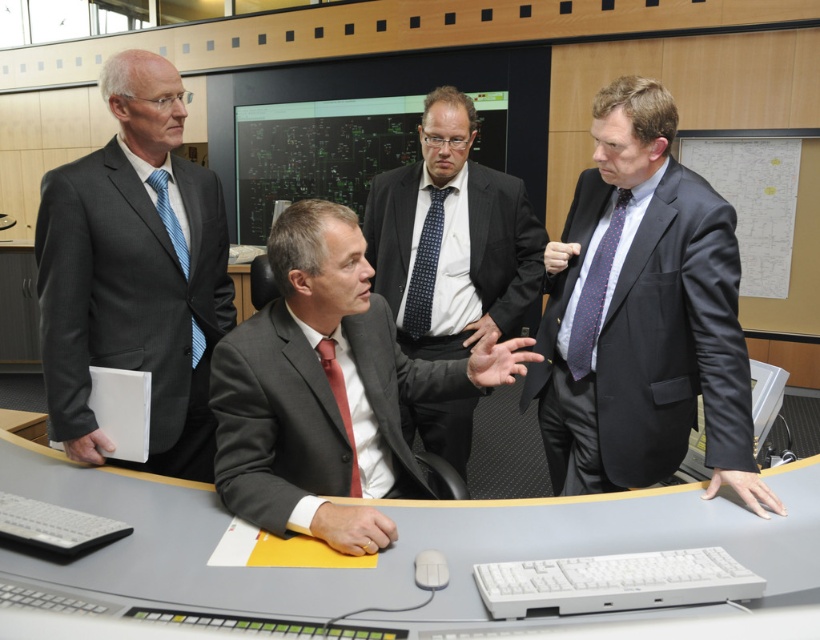
Which is more to the right, matte gray suit at center or black glossy monitor at center?

From the viewer's perspective, matte gray suit at center appears more on the right side.

What do you see at coordinates (328, 388) in the screenshot?
I see `matte gray suit at center` at bounding box center [328, 388].

Between point (271, 419) and point (269, 186), which one is positioned behind?

Positioned behind is point (269, 186).

You are a GUI agent. You are given a task and a screenshot of the screen. Output one action in this format:
    pyautogui.click(x=<x>, y=<y>)
    Task: Click on the matte gray suit at center
    The image size is (820, 640).
    Given the screenshot: What is the action you would take?
    pyautogui.click(x=328, y=388)

Which is more to the left, dark gray suit at right or dark blue dotted tie at right?

From the viewer's perspective, dark blue dotted tie at right appears more on the left side.

Who is more distant from viewer, (x=554, y=385) or (x=600, y=280)?

The point (x=554, y=385) is behind.

What do you see at coordinates (641, 316) in the screenshot? This screenshot has width=820, height=640. I see `dark gray suit at right` at bounding box center [641, 316].

You are a GUI agent. You are given a task and a screenshot of the screen. Output one action in this format:
    pyautogui.click(x=<x>, y=<y>)
    Task: Click on the dark gray suit at right
    
    Given the screenshot: What is the action you would take?
    pyautogui.click(x=641, y=316)

Who is positioned more to the right, dark gray suit at left or black glossy monitor at center?

Positioned to the right is dark gray suit at left.

Describe the element at coordinates (134, 273) in the screenshot. I see `dark gray suit at left` at that location.

Does point (125, 136) come behind point (254, 189)?

No, (125, 136) is closer to viewer.

You are a GUI agent. You are given a task and a screenshot of the screen. Output one action in this format:
    pyautogui.click(x=<x>, y=<y>)
    Task: Click on the dark gray suit at left
    
    Given the screenshot: What is the action you would take?
    134,273